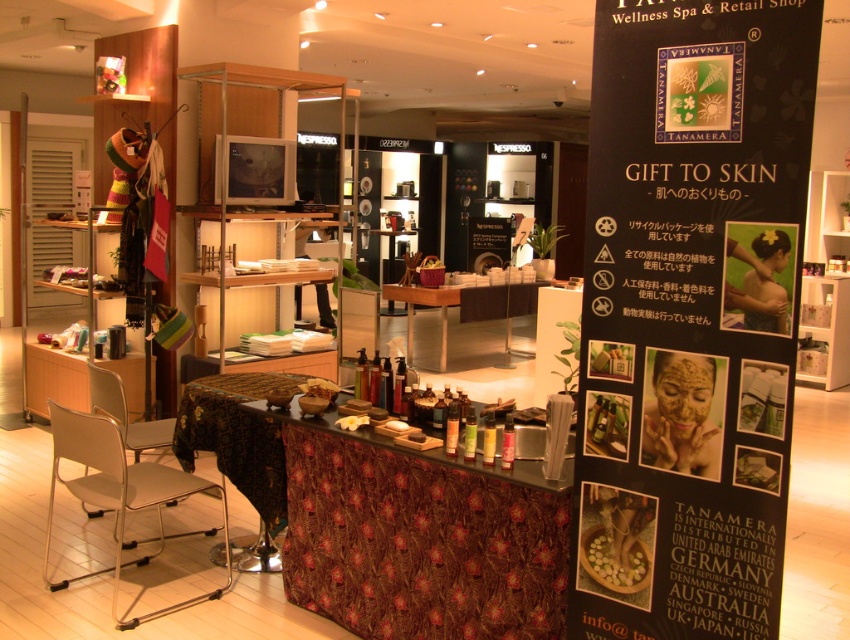
Can you confirm if black paper sign at right is shorter than white plastic chair at lower left?

Incorrect, black paper sign at right's height does not fall short of white plastic chair at lower left's.

Is black paper sign at right positioned at the back of white plastic chair at lower left?

No, it is in front of white plastic chair at lower left.

Does point (666, 388) come in front of point (76, 577)?

Yes, it is.

This screenshot has width=850, height=640. I want to click on black paper sign at right, so click(690, 314).

What are the coordinates of `black paper sign at right` in the screenshot? It's located at (690, 314).

Between black paper sign at right and metallic silver chair at lower left, which one is positioned higher?

Positioned higher is black paper sign at right.

This screenshot has width=850, height=640. I want to click on black paper sign at right, so click(x=690, y=314).

Where is `black paper sign at right`? The height and width of the screenshot is (640, 850). black paper sign at right is located at coordinates (690, 314).

Consider the image. Can you confirm if white plastic chair at lower left is wider than wooden table at center?

In fact, white plastic chair at lower left might be narrower than wooden table at center.

The image size is (850, 640). What do you see at coordinates (119, 493) in the screenshot? I see `white plastic chair at lower left` at bounding box center [119, 493].

This screenshot has height=640, width=850. Identify the location of white plastic chair at lower left. (119, 493).